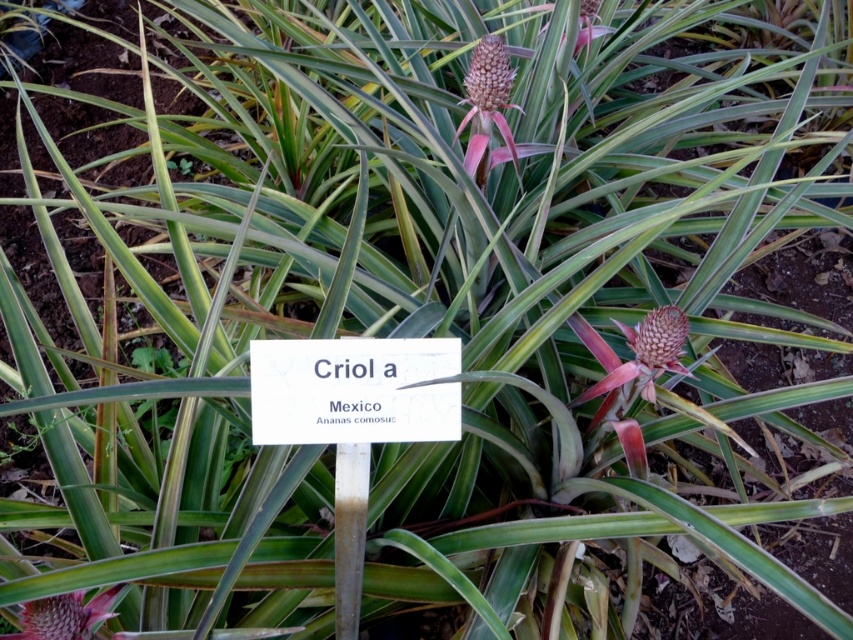
Is the position of white paper sign at center less distant than that of brown fuzzy pineapple at center?

Yes, it is.

Measure the distance between point (401, 362) and camera.

Point (401, 362) and camera are 93.35 centimeters apart.

Find the location of a particular element. This screenshot has width=853, height=640. white paper sign at center is located at coordinates (352, 390).

The width and height of the screenshot is (853, 640). In order to click on pink spiky pineapple at upper center in this screenshot , I will do `click(486, 104)`.

Is the position of pink spiky pineapple at upper center more distant than that of pink spiky pineapple at center?

Yes, it is.

Who is more forward, (486, 115) or (79, 621)?

Point (79, 621) is in front.

Locate an element on the screen. The width and height of the screenshot is (853, 640). pink spiky pineapple at upper center is located at coordinates (486, 104).

Between point (480, 179) and point (653, 358), which one is positioned behind?

Point (480, 179)

Is pink spiky pineapple at upper center bigger than brown fuzzy pineapple at center?

Indeed, pink spiky pineapple at upper center has a larger size compared to brown fuzzy pineapple at center.

Between point (476, 109) and point (670, 314), which one is positioned behind?

Point (476, 109)

What are the coordinates of `pink spiky pineapple at upper center` in the screenshot? It's located at (486, 104).